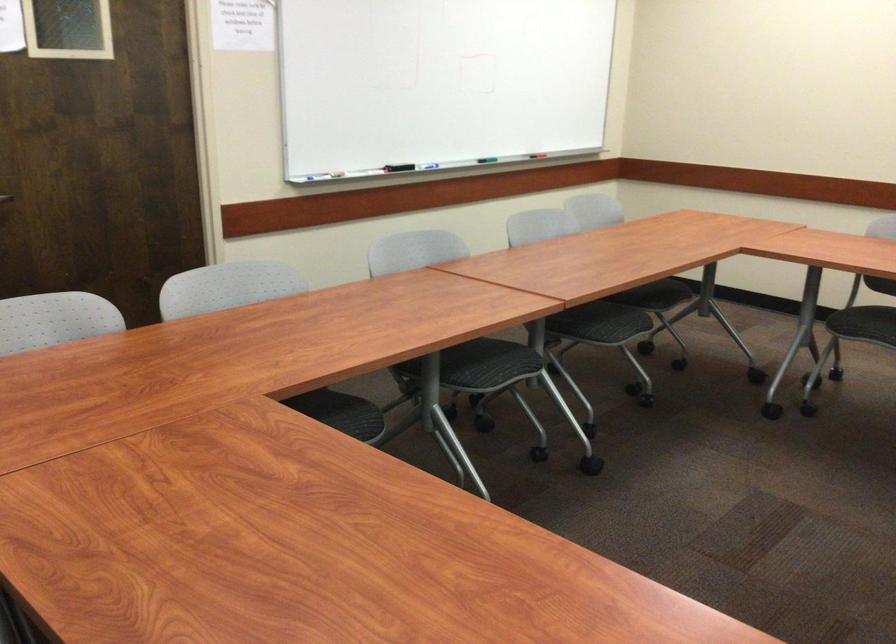
At what (x,y) coordinates should I click in order to perform the action: click on red whiteboard marker. Please return your answer as a coordinate pair (x, y). This screenshot has width=896, height=644. Looking at the image, I should click on (438, 82).